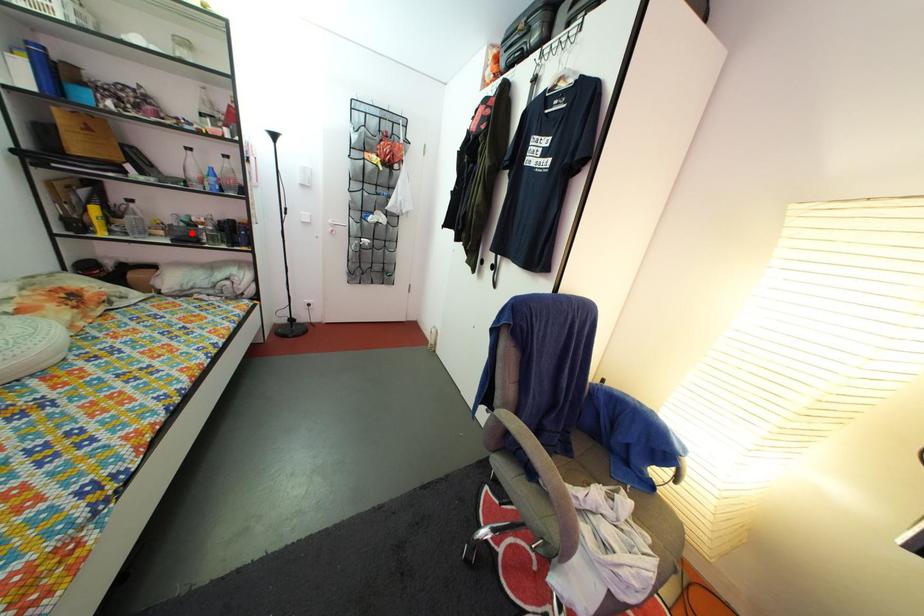
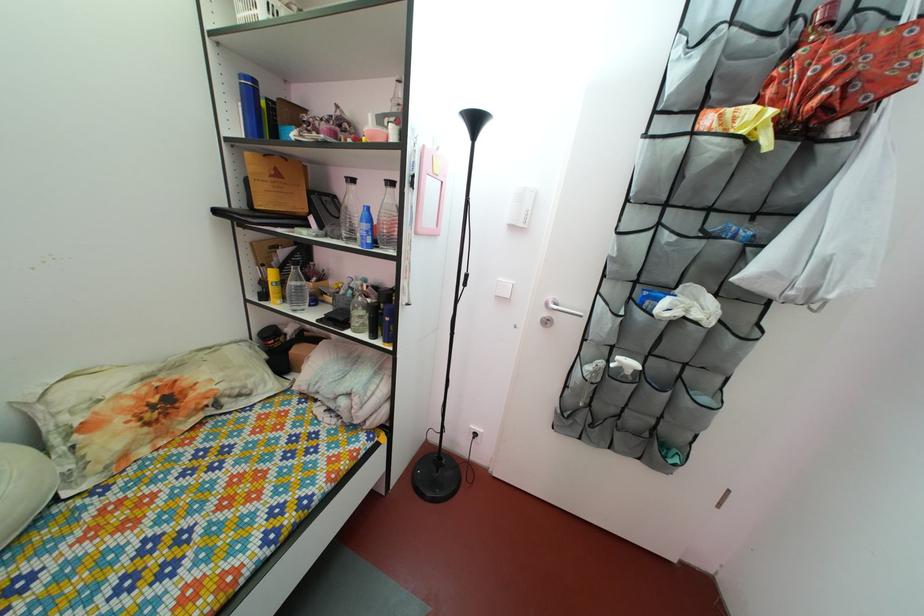
The point at the highlighted location is marked in the first image. Where is the corresponding point in the second image?

(359, 301)